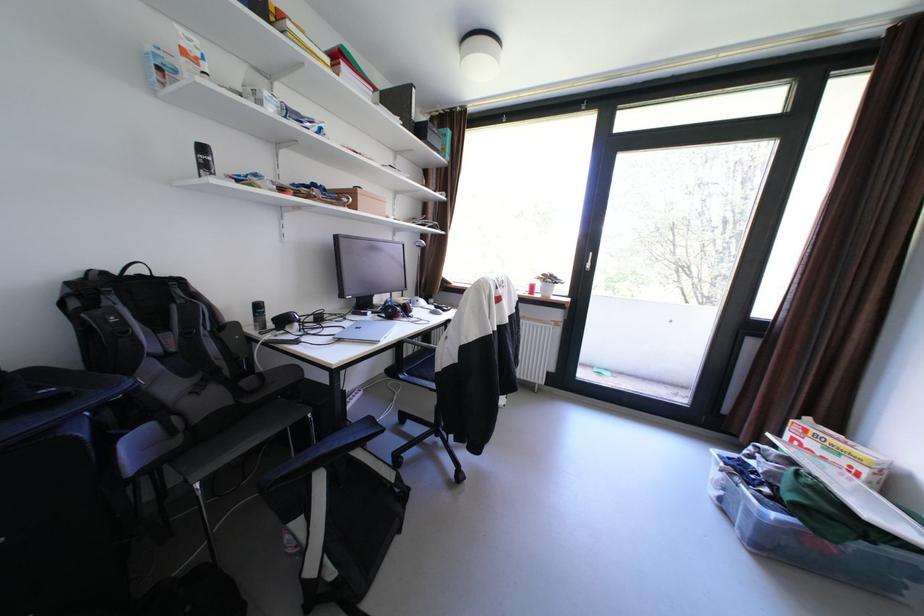
Locate an element on the screen. This screenshot has width=924, height=616. backpack top handle is located at coordinates (135, 268).